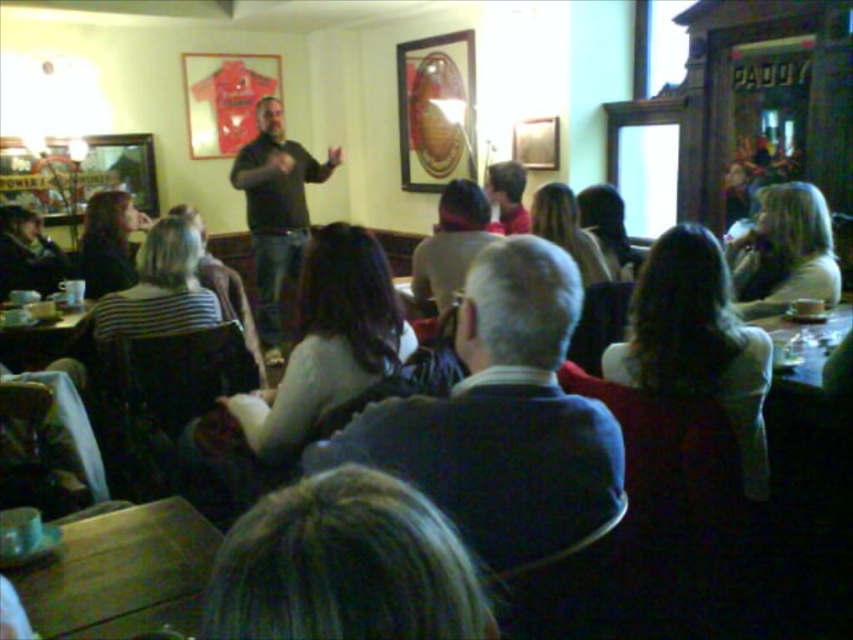
You are a photographer trying to capture a clear shot of both the dark blue sweater at center and the black matte shirt at center. Since you want to ensure both are visible, which one should you focus on first considering their sizes?

The dark blue sweater at center has a smaller size compared to the black matte shirt at center, so you should focus on the dark blue sweater at center first to ensure its details are captured clearly before adjusting for the larger one.